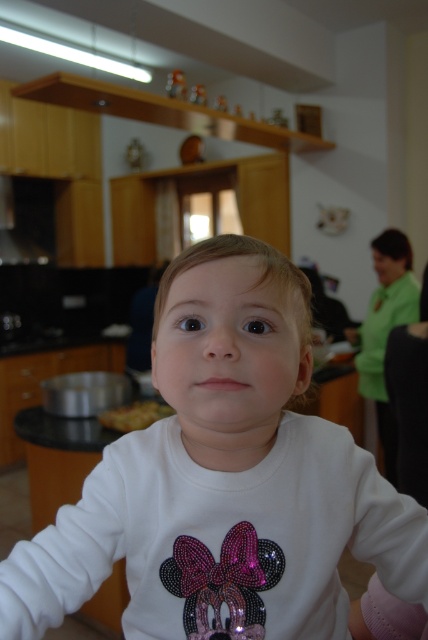
Question: Is white matte shirt at center bigger than yellowish matte food at lower left?

Choices:
 (A) no
 (B) yes

Answer: (B)

Question: Can you confirm if white matte shirt at center is positioned to the right of yellowish matte food at lower left?

Choices:
 (A) no
 (B) yes

Answer: (B)

Question: Which point is farther to the camera?

Choices:
 (A) yellowish matte food at lower left
 (B) white matte shirt at center

Answer: (A)

Question: Which point appears closest to the camera in this image?

Choices:
 (A) (258, 561)
 (B) (148, 420)

Answer: (A)

Question: Is white matte shirt at center positioned in front of yellowish matte food at lower left?

Choices:
 (A) no
 (B) yes

Answer: (B)

Question: Among these points, which one is farthest from the camera?

Choices:
 (A) (258, 566)
 (B) (109, 416)

Answer: (B)